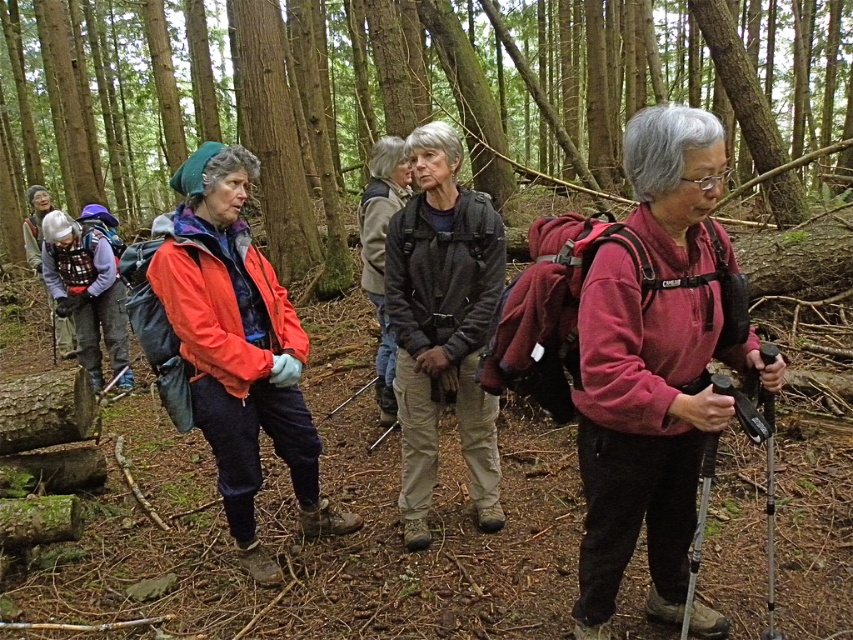
You are a hiker in the forest and you want to find the matte pink sweater at center. Based on the coordinates provided, where should you look relative to your current position?

The matte pink sweater at center is located at coordinates point (653, 368), so you should look towards the center of the image to find it.

You are a hiker in the forest and want to take a photo of the brown wood tree at center and the matte pink sweater at center. Since you want both in the frame, can you position yourself so that both are visible without one blocking the other?

The matte pink sweater at center is behind the brown wood tree at center, so if you position yourself in front of the brown wood tree at center, you can see both the brown wood tree at center and the matte pink sweater at center in the background. However, the sweater may be partially obscured by the tree.

You are a hiker trying to take a photo of the matte orange jacket at center. You need to ensure the entire jacket is visible in the frame. Given that the brown wood tree at center is blocking part of the view, can you determine if the tree is wider than the jacket?

The brown wood tree at center is wider than the matte orange jacket at center, so the tree may block part of the jacket in the photo.